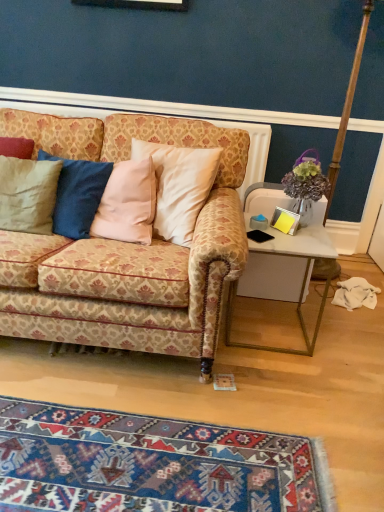
Question: Would you say wooden pole at right is inside or outside matte beige pillow at left?

Choices:
 (A) inside
 (B) outside

Answer: (B)

Question: Considering the positions of wooden pole at right and matte beige pillow at left in the image, is wooden pole at right bigger or smaller than matte beige pillow at left?

Choices:
 (A) big
 (B) small

Answer: (A)

Question: Which object is the closest to the patterned fabric couch at center?

Choices:
 (A) wooden pole at right
 (B) blue woven rug at lower center
 (C) white glossy desk at right
 (D) matte beige pillow at left

Answer: (D)

Question: Considering the real-world distances, which object is farthest from the wooden pole at right?

Choices:
 (A) blue woven rug at lower center
 (B) white glossy desk at right
 (C) matte beige pillow at left
 (D) patterned fabric couch at center

Answer: (A)